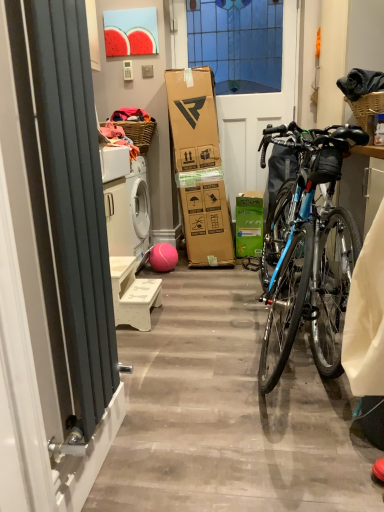
Question: Considering the relative sizes of matte black radiator at left and woven brown picnic basket at right, which is the first picnic basket in front-to-back order, in the image provided, is matte black radiator at left thinner than woven brown picnic basket at right, which is the first picnic basket in front-to-back order,?

Choices:
 (A) no
 (B) yes

Answer: (B)

Question: Considering the relative positions of matte black radiator at left and woven brown picnic basket at right, acting as the 1th picnic basket starting from the right, in the image provided, is matte black radiator at left to the left of woven brown picnic basket at right, acting as the 1th picnic basket starting from the right, from the viewer's perspective?

Choices:
 (A) yes
 (B) no

Answer: (A)

Question: Could woven brown picnic basket at right, the second picnic basket viewed from the back, be considered to be inside matte black radiator at left?

Choices:
 (A) no
 (B) yes

Answer: (A)

Question: Does matte black radiator at left have a lesser height compared to woven brown picnic basket at right, which is the first picnic basket in front-to-back order?

Choices:
 (A) yes
 (B) no

Answer: (B)

Question: Is matte black radiator at left outside of woven brown picnic basket at right, the second picnic basket positioned from the left?

Choices:
 (A) no
 (B) yes

Answer: (B)

Question: Considering the relative positions of matte black radiator at left and woven brown picnic basket at right, the second picnic basket viewed from the back, in the image provided, is matte black radiator at left behind woven brown picnic basket at right, the second picnic basket viewed from the back,?

Choices:
 (A) yes
 (B) no

Answer: (B)

Question: From the image's perspective, is woven brown picnic basket at right, which is the first picnic basket in front-to-back order, beneath green matte box at center?

Choices:
 (A) no
 (B) yes

Answer: (A)

Question: Is the position of woven brown picnic basket at right, the second picnic basket viewed from the back, less distant than that of green matte box at center?

Choices:
 (A) yes
 (B) no

Answer: (A)

Question: Can you confirm if woven brown picnic basket at right, which is the first picnic basket in front-to-back order, is thinner than green matte box at center?

Choices:
 (A) no
 (B) yes

Answer: (B)

Question: Is woven brown picnic basket at right, which is the first picnic basket in front-to-back order, not within green matte box at center?

Choices:
 (A) no
 (B) yes

Answer: (B)

Question: Does woven brown picnic basket at right, which is the first picnic basket in front-to-back order, have a greater height compared to green matte box at center?

Choices:
 (A) yes
 (B) no

Answer: (B)

Question: Does woven brown picnic basket at right, the second picnic basket positioned from the left, have a larger size compared to green matte box at center?

Choices:
 (A) no
 (B) yes

Answer: (A)

Question: Considering the relative positions of white plastic power outlet at upper center and rubber ball at center in the image provided, is white plastic power outlet at upper center to the left of rubber ball at center from the viewer's perspective?

Choices:
 (A) no
 (B) yes

Answer: (B)